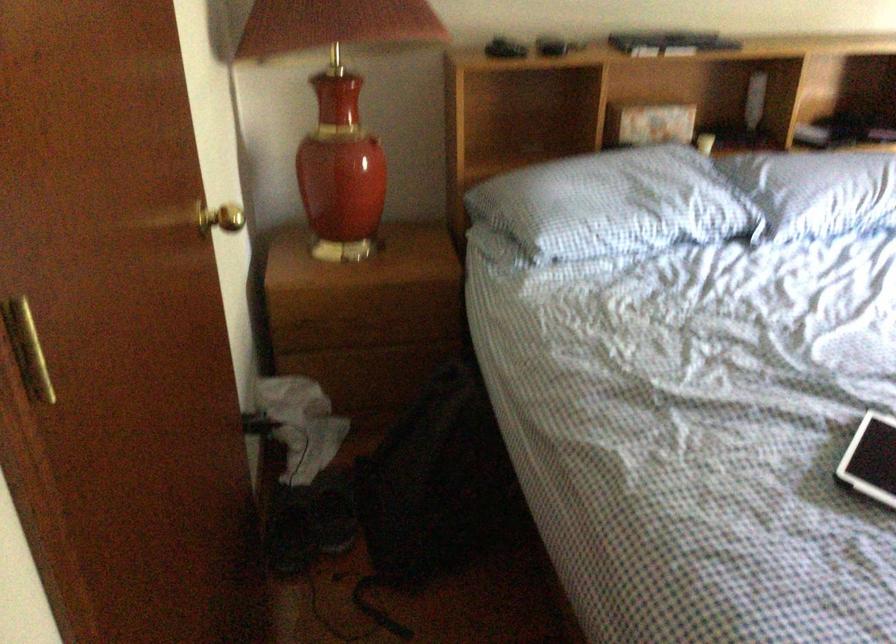
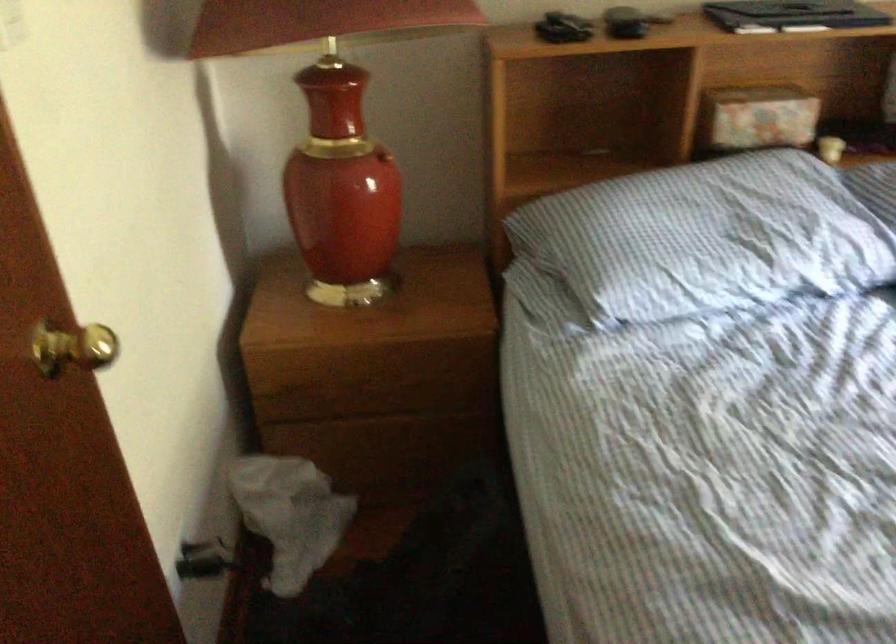
Question: The camera is either moving clockwise (left) or counter-clockwise (right) around the object. The first image is from the beginning of the video and the second image is from the end. Is the camera moving left or right when shooting the video?

Choices:
 (A) Left
 (B) Right

Answer: (B)